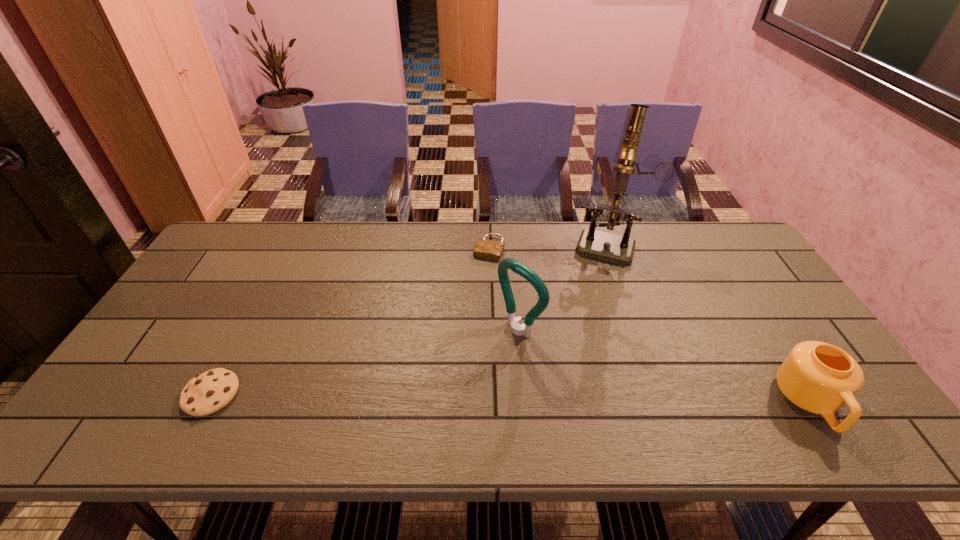
This screenshot has width=960, height=540. In order to click on microscope present at the far edge in this screenshot , I will do `click(612, 247)`.

You are a GUI agent. You are given a task and a screenshot of the screen. Output one action in this format:
    pyautogui.click(x=<x>, y=<y>)
    Task: Click on the cookie at the near edge
    
    Given the screenshot: What is the action you would take?
    pyautogui.click(x=209, y=392)

Where is `mug situated at the near edge`? mug situated at the near edge is located at coordinates (818, 377).

You are a GUI agent. You are given a task and a screenshot of the screen. Output one action in this format:
    pyautogui.click(x=<x>, y=<y>)
    Task: Click on the object situated at the right edge
    This screenshot has height=540, width=960.
    Given the screenshot: What is the action you would take?
    pos(818,377)

This screenshot has width=960, height=540. I want to click on object that is at the near right corner, so click(x=818, y=377).

You are a GUI agent. You are given a task and a screenshot of the screen. Output one action in this format:
    pyautogui.click(x=<x>, y=<y>)
    Task: Click on the vacant space at the far edge
    The image size is (960, 540).
    Given the screenshot: What is the action you would take?
    pyautogui.click(x=482, y=235)

Where is `vacant space at the near edge of the desktop`? Image resolution: width=960 pixels, height=540 pixels. vacant space at the near edge of the desktop is located at coordinates (386, 387).

In the image, there is a desktop. Identify the location of vacant space at the right edge. Image resolution: width=960 pixels, height=540 pixels. (795, 323).

Identify the location of vacant area at the far left corner of the desktop. The width and height of the screenshot is (960, 540). (234, 258).

Locate an element on the screen. Image resolution: width=960 pixels, height=540 pixels. free space at the far right corner of the desktop is located at coordinates 732,265.